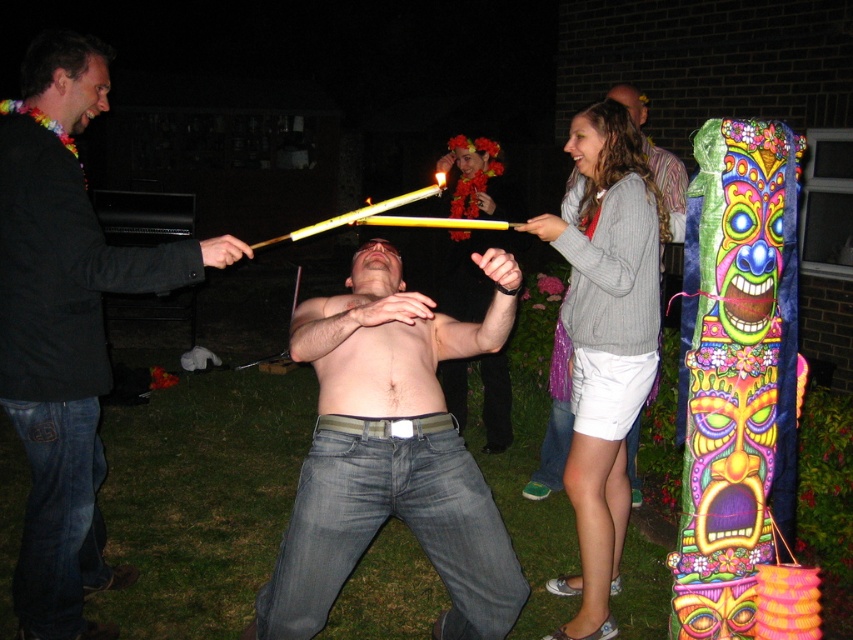
Question: Which point is farther to the camera?

Choices:
 (A) denim jeans at center
 (B) black leather jacket at left

Answer: (B)

Question: Does denim jeans at center have a smaller size compared to matte black shirt at upper center?

Choices:
 (A) no
 (B) yes

Answer: (A)

Question: Does black leather jacket at left appear on the left side of matte black shirt at upper center?

Choices:
 (A) no
 (B) yes

Answer: (B)

Question: Which object is the closest to the denim jeans at center?

Choices:
 (A) matte black shirt at upper center
 (B) black leather jacket at left
 (C) gray sweater at upper center

Answer: (C)

Question: Which is farther from the gray sweater at upper center?

Choices:
 (A) black leather jacket at left
 (B) matte black shirt at upper center

Answer: (B)

Question: Can you confirm if denim jeans at center is positioned below black leather jacket at left?

Choices:
 (A) no
 (B) yes

Answer: (B)